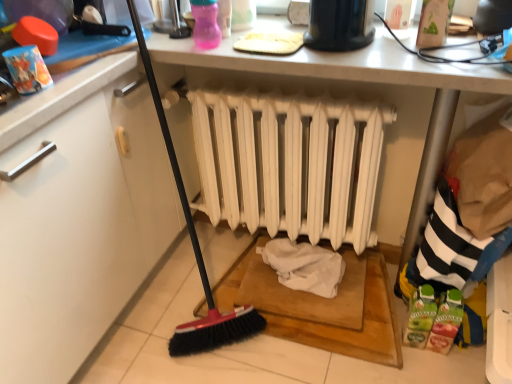
Locate an element on the screen. This screenshot has height=384, width=512. white matte radiator at center is located at coordinates (290, 163).

Measure the distance between white matte radiator at center and camera.

A distance of 1.24 meters exists between white matte radiator at center and camera.

The width and height of the screenshot is (512, 384). What do you see at coordinates (290, 163) in the screenshot?
I see `white matte radiator at center` at bounding box center [290, 163].

Measure the distance between point (348, 46) and camera.

Point (348, 46) is 1.13 meters away from camera.

What do you see at coordinates (339, 25) in the screenshot? I see `black plastic toaster at upper center` at bounding box center [339, 25].

What is the approximate height of black plastic toaster at upper center?

black plastic toaster at upper center is 5.51 inches tall.

The image size is (512, 384). In order to click on black plastic toaster at upper center in this screenshot , I will do `click(339, 25)`.

At what (x,y) coordinates should I click in order to perform the action: click on white matte radiator at center. Please return your answer as a coordinate pair (x, y). Image resolution: width=512 pixels, height=384 pixels. Looking at the image, I should click on (290, 163).

Considering the relative positions of white matte radiator at center and black plastic toaster at upper center in the image provided, is white matte radiator at center to the left or to the right of black plastic toaster at upper center?

white matte radiator at center is to the left of black plastic toaster at upper center.

Considering the positions of objects white matte radiator at center and black plastic toaster at upper center in the image provided, who is in front, white matte radiator at center or black plastic toaster at upper center?

black plastic toaster at upper center is closer to the camera.

Which is in front, point (266, 223) or point (321, 30)?

The point (321, 30) is closer to the camera.

From the image's perspective, which object appears higher, white matte radiator at center or black plastic toaster at upper center?

black plastic toaster at upper center, from the image's perspective.

From a real-world perspective, which object rests below the other?

white matte radiator at center, from a real-world perspective.

Which of these two, white matte radiator at center or black plastic toaster at upper center, is thinner?

white matte radiator at center.

Who is shorter, white matte radiator at center or black plastic toaster at upper center?

With less height is black plastic toaster at upper center.

Based on their sizes in the image, would you say white matte radiator at center is bigger or smaller than black plastic toaster at upper center?

Considering their sizes, white matte radiator at center takes up more space than black plastic toaster at upper center.

Is white matte radiator at center not within black plastic toaster at upper center?

Yes.

Is white matte radiator at center in contact with black plastic toaster at upper center?

They are not placed beside each other.

Does white matte radiator at center turn towards black plastic toaster at upper center?

No, white matte radiator at center does not turn towards black plastic toaster at upper center.

The width and height of the screenshot is (512, 384). I want to click on radiator behind the black plastic toaster at upper center, so click(290, 163).

Based on their positions, is black plastic toaster at upper center located to the left or right of white matte radiator at center?

In the image, black plastic toaster at upper center appears on the right side of white matte radiator at center.

Between black plastic toaster at upper center and white matte radiator at center, which one is positioned behind?

white matte radiator at center.

Considering the positions of point (342, 38) and point (227, 122), is point (342, 38) closer or farther from the camera than point (227, 122)?

Clearly, point (342, 38) is closer to the camera than point (227, 122).

From the image's perspective, is black plastic toaster at upper center above white matte radiator at center?

Correct, black plastic toaster at upper center appears higher than white matte radiator at center in the image.

From a real-world perspective, between black plastic toaster at upper center and white matte radiator at center, who is vertically lower?

white matte radiator at center.

Is black plastic toaster at upper center thinner than white matte radiator at center?

In fact, black plastic toaster at upper center might be wider than white matte radiator at center.

From their relative heights in the image, would you say black plastic toaster at upper center is taller or shorter than white matte radiator at center?

black plastic toaster at upper center is shorter than white matte radiator at center.

Who is bigger, black plastic toaster at upper center or white matte radiator at center?

Bigger between the two is white matte radiator at center.

Is black plastic toaster at upper center outside of white matte radiator at center?

Yes, black plastic toaster at upper center is located beyond the bounds of white matte radiator at center.

Is black plastic toaster at upper center not close to white matte radiator at center?

They are positioned close to each other.

Is black plastic toaster at upper center aimed at white matte radiator at center?

No, black plastic toaster at upper center does not turn towards white matte radiator at center.

Find the location of a particular element. The image size is (512, 384). radiator located underneath the black plastic toaster at upper center (from a real-world perspective) is located at coordinates (290, 163).

I want to click on radiator behind the black plastic toaster at upper center, so click(x=290, y=163).

This screenshot has width=512, height=384. I want to click on radiator on the left of the black plastic toaster at upper center, so click(x=290, y=163).